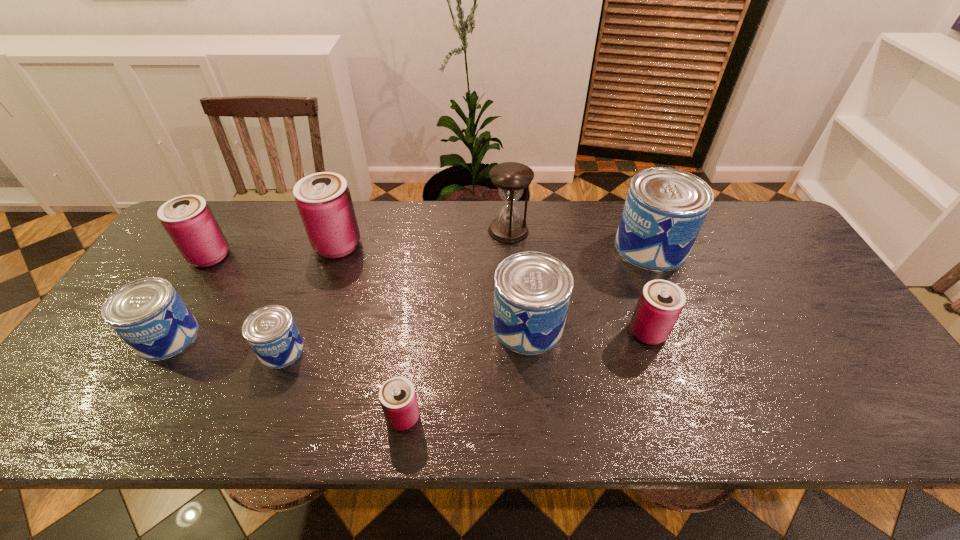
The height and width of the screenshot is (540, 960). Identify the location of the third pink can from left to right. (397, 395).

Locate an element on the screen. The image size is (960, 540). the fifth object from right to left is located at coordinates (397, 395).

This screenshot has height=540, width=960. I want to click on the second blue can from left to right, so click(x=271, y=332).

Locate an element on the screen. The width and height of the screenshot is (960, 540). free space located 0.180m on the front of the third pink can from right to left is located at coordinates (316, 309).

At what (x,y) coordinates should I click in order to perform the action: click on vacant region located 0.260m on the front label of the farthest blue can. Please return your answer as a coordinate pair (x, y). The height and width of the screenshot is (540, 960). Looking at the image, I should click on (530, 247).

Identify the location of vacant space located 0.340m on the front label of the farthest blue can. This screenshot has width=960, height=540. (503, 247).

The height and width of the screenshot is (540, 960). Identify the location of free space located on the front label of the farthest blue can. (553, 247).

Image resolution: width=960 pixels, height=540 pixels. I want to click on free location located on the right of the hourglass, so click(x=570, y=231).

Identify the location of vacant point located 0.070m on the right of the third smallest pink can. The height and width of the screenshot is (540, 960). (253, 256).

This screenshot has width=960, height=540. What are the coordinates of `blank area located 0.190m on the front label of the sixth can from left to right` in the screenshot? It's located at (419, 326).